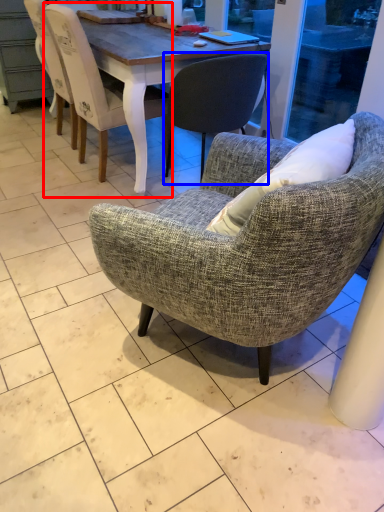
Question: Which object is closer to the camera taking this photo, chair (highlighted by a red box) or chair (highlighted by a blue box)?

Choices:
 (A) chair
 (B) chair

Answer: (B)